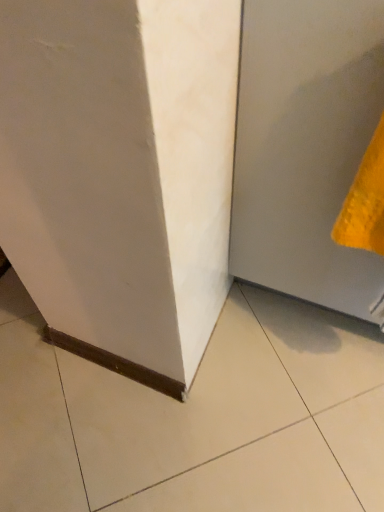
Question: Considering the positions of point (365, 234) and point (307, 243), is point (365, 234) closer or farther from the camera than point (307, 243)?

Choices:
 (A) closer
 (B) farther

Answer: (A)

Question: Looking at their shapes, would you say yellow textured towel at right is wider or thinner than matte gray door at lower right?

Choices:
 (A) wide
 (B) thin

Answer: (B)

Question: From a real-world perspective, is yellow textured towel at right positioned above or below matte gray door at lower right?

Choices:
 (A) above
 (B) below

Answer: (A)

Question: From a real-world perspective, is matte gray door at lower right physically located above or below yellow textured towel at right?

Choices:
 (A) above
 (B) below

Answer: (B)

Question: Considering the relative positions of matte gray door at lower right and yellow textured towel at right in the image provided, is matte gray door at lower right to the left or to the right of yellow textured towel at right?

Choices:
 (A) left
 (B) right

Answer: (B)

Question: Considering the positions of matte gray door at lower right and yellow textured towel at right in the image, is matte gray door at lower right taller or shorter than yellow textured towel at right?

Choices:
 (A) tall
 (B) short

Answer: (A)

Question: Considering their positions, is matte gray door at lower right located in front of or behind yellow textured towel at right?

Choices:
 (A) behind
 (B) front

Answer: (B)